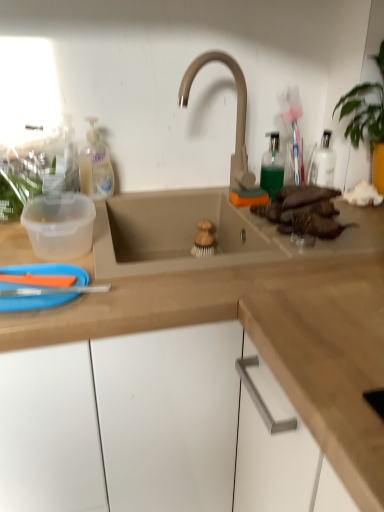
Question: From the image's perspective, does blue plastic paper plate at lower left appear higher than translucent plastic bottle at upper left?

Choices:
 (A) no
 (B) yes

Answer: (A)

Question: From the image's perspective, does blue plastic paper plate at lower left appear lower than translucent plastic bottle at upper left?

Choices:
 (A) no
 (B) yes

Answer: (B)

Question: Would you say blue plastic paper plate at lower left is outside translucent plastic bottle at upper left?

Choices:
 (A) yes
 (B) no

Answer: (A)

Question: Can you confirm if blue plastic paper plate at lower left is bigger than translucent plastic bottle at upper left?

Choices:
 (A) yes
 (B) no

Answer: (B)

Question: Does blue plastic paper plate at lower left have a lesser width compared to translucent plastic bottle at upper left?

Choices:
 (A) yes
 (B) no

Answer: (B)

Question: From a real-world perspective, is matte beige faucet at center above or below blue plastic paper plate at lower left?

Choices:
 (A) below
 (B) above

Answer: (B)

Question: Looking at their shapes, would you say matte beige faucet at center is wider or thinner than blue plastic paper plate at lower left?

Choices:
 (A) thin
 (B) wide

Answer: (A)

Question: Which is correct: matte beige faucet at center is inside blue plastic paper plate at lower left, or outside of it?

Choices:
 (A) outside
 (B) inside

Answer: (A)

Question: Is matte beige faucet at center to the left or to the right of blue plastic paper plate at lower left in the image?

Choices:
 (A) right
 (B) left

Answer: (A)

Question: In the image, is blue plastic paper plate at lower left on the left side or the right side of translucent plastic bottle at upper left?

Choices:
 (A) left
 (B) right

Answer: (A)

Question: From a real-world perspective, is blue plastic paper plate at lower left positioned above or below translucent plastic bottle at upper left?

Choices:
 (A) above
 (B) below

Answer: (B)

Question: Looking at the image, does blue plastic paper plate at lower left seem bigger or smaller compared to translucent plastic bottle at upper left?

Choices:
 (A) small
 (B) big

Answer: (A)

Question: From the image's perspective, is blue plastic paper plate at lower left positioned above or below translucent plastic bottle at upper left?

Choices:
 (A) above
 (B) below

Answer: (B)

Question: Choose the correct answer: Is green translucent bottle at upper right inside translucent plastic bottle at upper left or outside it?

Choices:
 (A) outside
 (B) inside

Answer: (A)

Question: Visually, is green translucent bottle at upper right positioned to the left or to the right of translucent plastic bottle at upper left?

Choices:
 (A) left
 (B) right

Answer: (B)